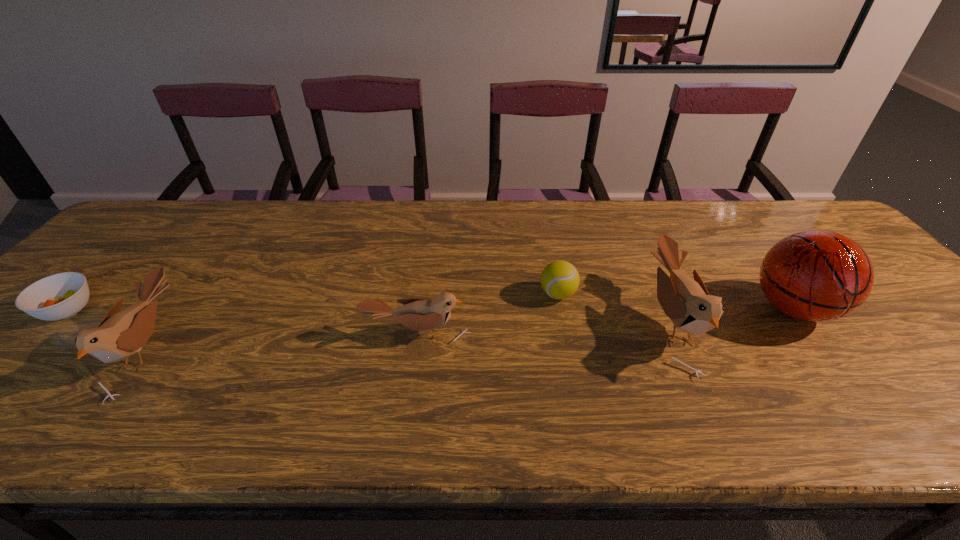
What are the coordinates of `the shortest object` in the screenshot? It's located at click(x=59, y=296).

You are a GUI agent. You are given a task and a screenshot of the screen. Output one action in this format:
    pyautogui.click(x=<x>, y=<y>)
    Task: Click on the vacant space located at the beak of the second shortest bird
    This screenshot has width=960, height=540.
    Given the screenshot: What is the action you would take?
    pyautogui.click(x=97, y=348)

The height and width of the screenshot is (540, 960). I want to click on vacant point located 0.080m at the beak of the second shortest bird, so click(92, 348).

This screenshot has width=960, height=540. In order to click on vacant space located 0.100m at the beak of the second shortest bird in this screenshot , I will do `click(84, 348)`.

Identify the location of vacant area situated at the beak of the second bird from right to left. The width and height of the screenshot is (960, 540). (410, 388).

The height and width of the screenshot is (540, 960). Identify the location of vacant space situated at the beak of the rightmost bird. (616, 322).

At what (x,y) coordinates should I click in order to perform the action: click on vacant space located at the beak of the rightmost bird. Please return your answer as a coordinate pair (x, y). Looking at the image, I should click on (494, 322).

I want to click on vacant space located 0.310m at the beak of the rightmost bird, so click(520, 322).

Where is `free location located 0.060m on the side with spill of the rightmost object`? The image size is (960, 540). free location located 0.060m on the side with spill of the rightmost object is located at coordinates [833, 363].

This screenshot has height=540, width=960. I want to click on vacant area situated on the left of the fourth object from left to right, so click(465, 294).